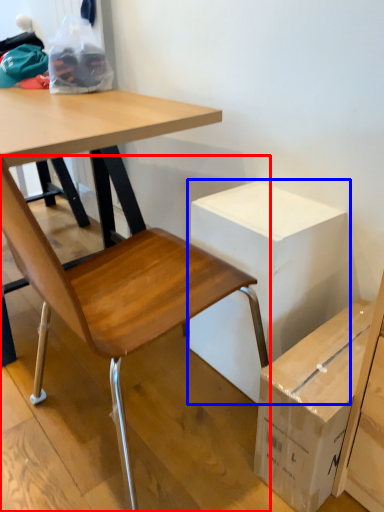
Question: Which object appears farthest to the camera in this image, chair (highlighted by a red box) or cardboard box (highlighted by a blue box)?

Choices:
 (A) chair
 (B) cardboard box

Answer: (B)